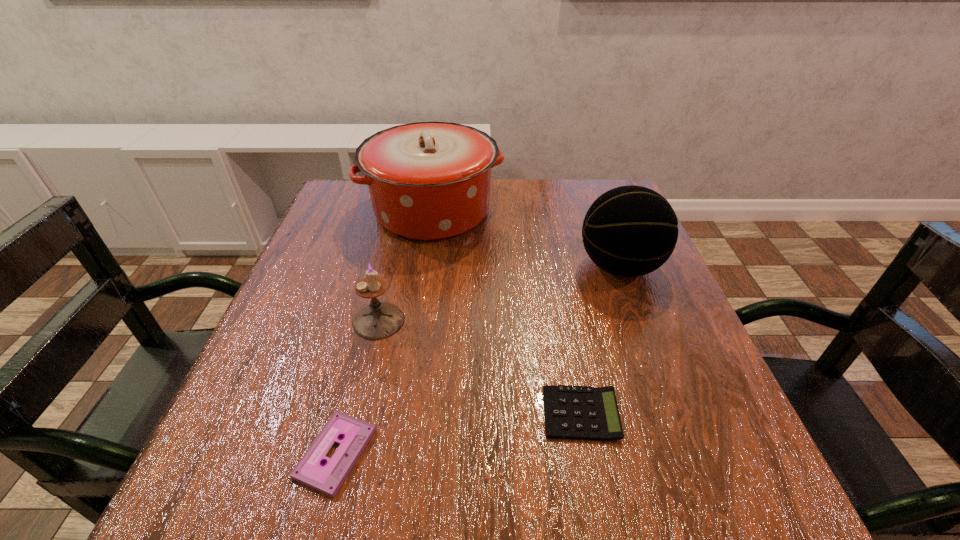
Find the location of `vacant space located 0.110m on the back of the videotape`. vacant space located 0.110m on the back of the videotape is located at coordinates (360, 359).

Locate an element on the screen. This screenshot has width=960, height=540. object positioned at the far edge is located at coordinates (428, 181).

I want to click on object present at the near edge, so click(327, 478).

At what (x,y) coordinates should I click in order to perform the action: click on casserole located at the left edge. Please return your answer as a coordinate pair (x, y). The image size is (960, 540). Looking at the image, I should click on (428, 181).

The image size is (960, 540). What are the coordinates of `candle holder situated at the left edge` in the screenshot? It's located at (378, 320).

The image size is (960, 540). What are the coordinates of `videotape that is at the left edge` in the screenshot? It's located at (327, 478).

You are a GUI agent. You are given a task and a screenshot of the screen. Output one action in this format:
    pyautogui.click(x=<x>, y=<y>)
    Task: Click on the object situated at the right edge
    
    Given the screenshot: What is the action you would take?
    pyautogui.click(x=629, y=231)

Where is `object that is at the far left corner`? This screenshot has width=960, height=540. object that is at the far left corner is located at coordinates (428, 181).

Image resolution: width=960 pixels, height=540 pixels. Find the location of `object located in the near left corner section of the desktop`. object located in the near left corner section of the desktop is located at coordinates pyautogui.click(x=327, y=478).

Identify the location of vacant space at the near edge of the desktop. The image size is (960, 540). (378, 470).